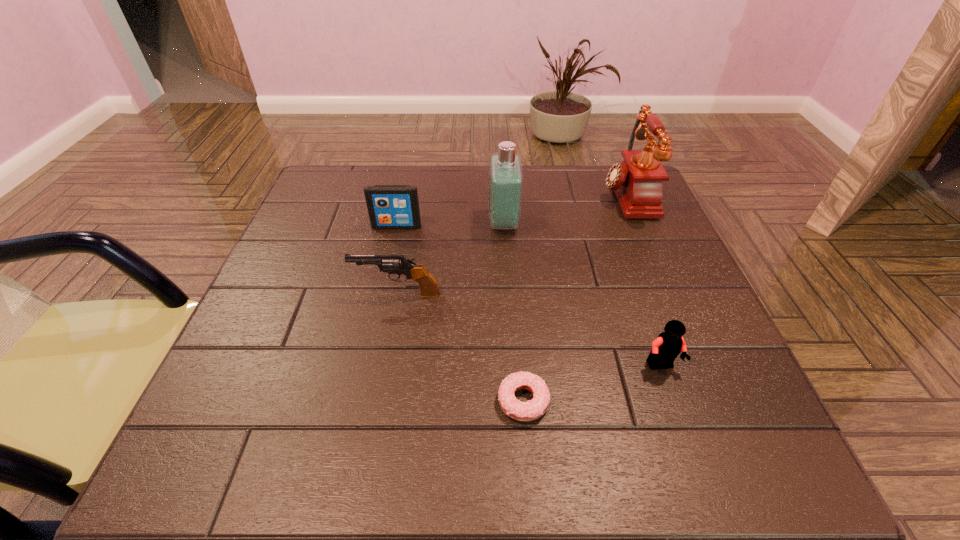
This screenshot has height=540, width=960. Identify the location of vacant point located on the front label of the perfume. (401, 223).

Where is `vacant space situated on the front label of the perfume`? The width and height of the screenshot is (960, 540). vacant space situated on the front label of the perfume is located at coordinates (368, 223).

Where is `free space located on the front label of the perfume`? free space located on the front label of the perfume is located at coordinates (322, 223).

Where is `vacant space located on the front screen of the iPod`? The height and width of the screenshot is (540, 960). vacant space located on the front screen of the iPod is located at coordinates (x=373, y=333).

Locate an element on the screen. This screenshot has width=960, height=540. free space located 0.140m along the barrel of the third nearest object is located at coordinates (285, 294).

Locate an element on the screen. The width and height of the screenshot is (960, 540). free region located 0.120m along the barrel of the third nearest object is located at coordinates (296, 294).

At what (x,y) coordinates should I click in order to perform the action: click on free space located 0.050m along the barrel of the third nearest object. Please return your answer as a coordinate pair (x, y). The height and width of the screenshot is (540, 960). Looking at the image, I should click on (330, 294).

You are a GUI agent. You are given a task and a screenshot of the screen. Output one action in this format:
    pyautogui.click(x=<x>, y=<y>)
    Task: Click on the free spot located 0.160m on the front-facing side of the second nearest object
    Image resolution: width=960 pixels, height=540 pixels.
    Given the screenshot: What is the action you would take?
    point(699,472)

Where is `vacant space located on the left of the shortest object`? This screenshot has width=960, height=540. vacant space located on the left of the shortest object is located at coordinates (282, 401).

Locate an element on the screen. The image size is (960, 540). telephone that is at the far edge is located at coordinates (637, 182).